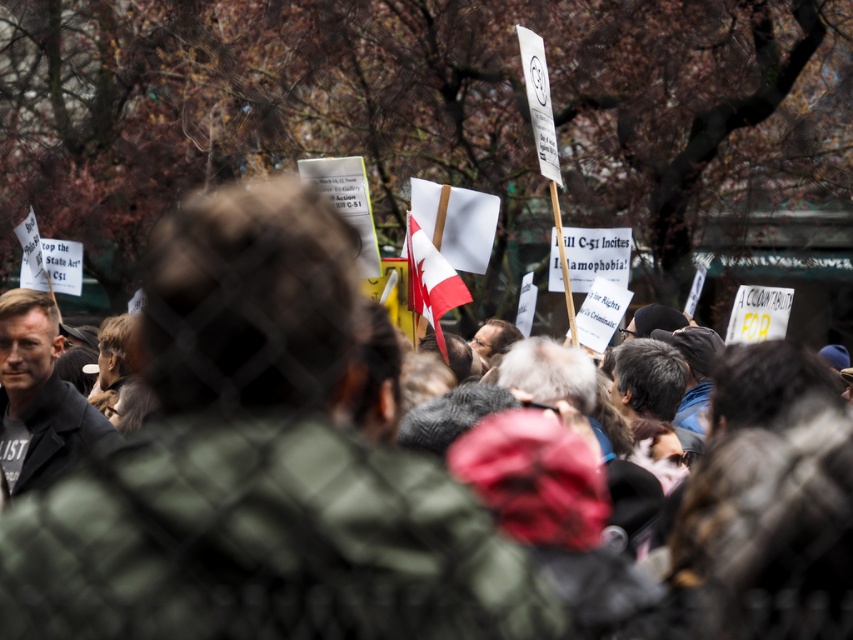
You are a photographer trying to capture the protest scene through the chain link fence. You notice two flags in your viewfinder. The red and white fabric flag at center and the white paper flag at upper left. Which flag would appear bigger in the photo?

The red and white fabric flag at center is larger in size than the white paper flag at upper left, so it would appear bigger in the photo.

You are a photographer trying to capture the protest scene through the chain link fence. You notice two flags in your viewfinder. The first is the red and white fabric flag at center, and the second is the white paper flag at upper left. Which flag should you focus on if you want to capture the larger flag in your shot?

The red and white fabric flag at center is taller than the white paper flag at upper left, so you should focus on the red and white fabric flag at center to capture the larger flag in your shot.